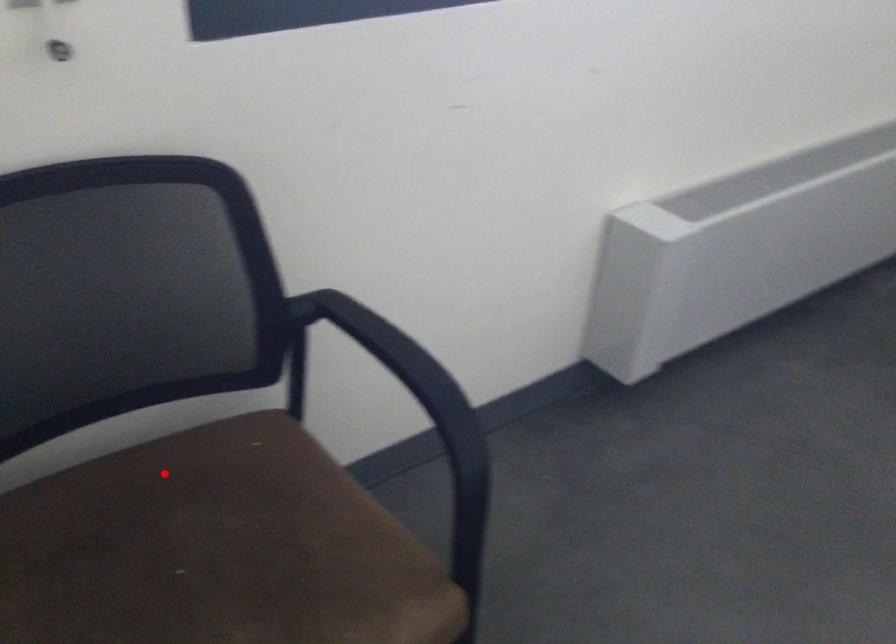
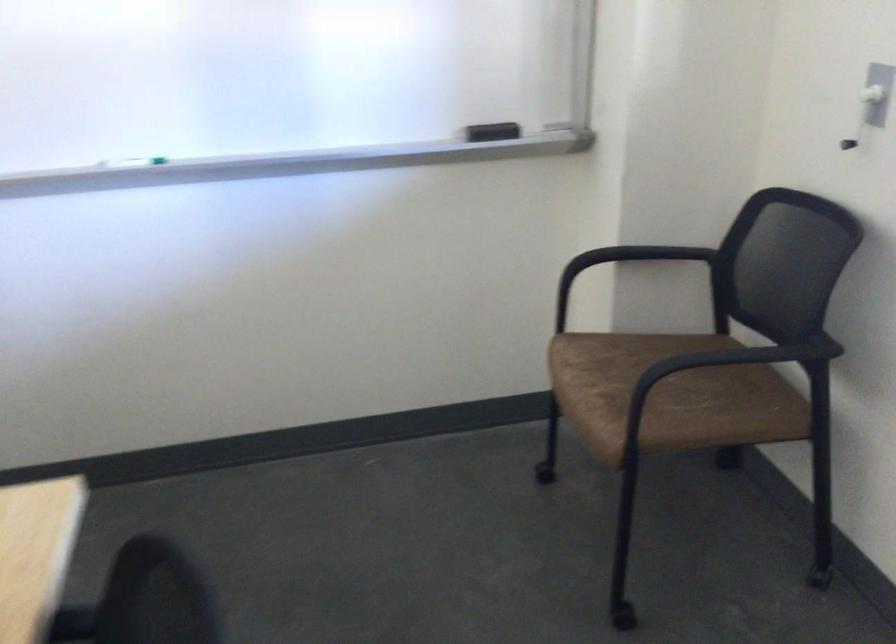
Question: I am providing you with two images of the same scene from different viewpoints. Given a red point in image1, look at the same physical point in image2. Is it:

Choices:
 (A) Closer to the viewpoint
 (B) Farther from the viewpoint

Answer: (B)